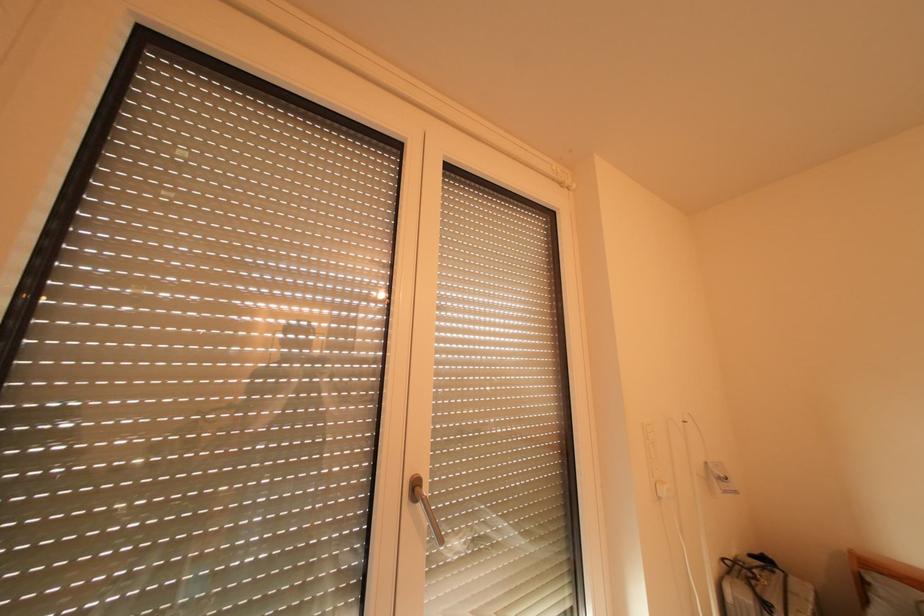
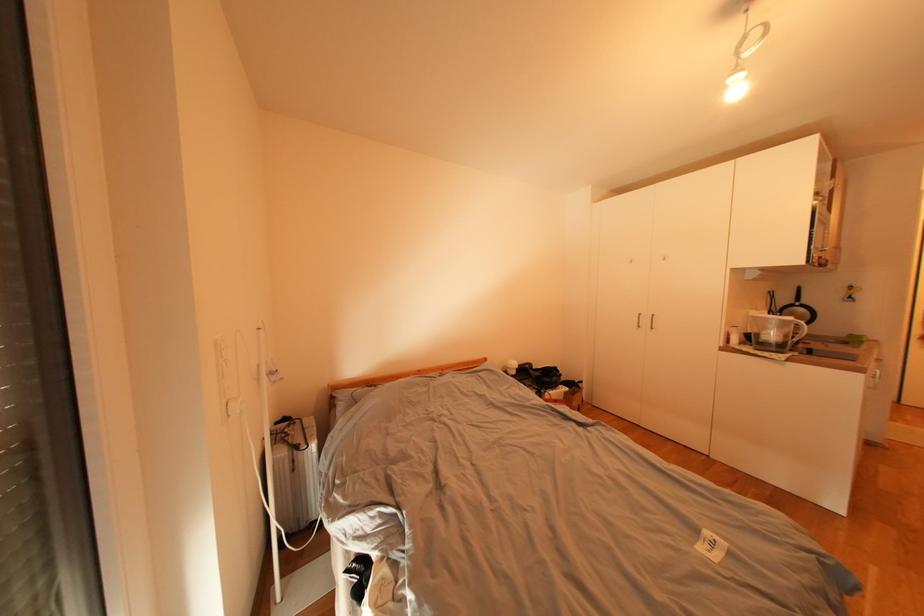
Question: How did the camera likely rotate?

Choices:
 (A) Left
 (B) Right
 (C) Up
 (D) Down

Answer: (B)